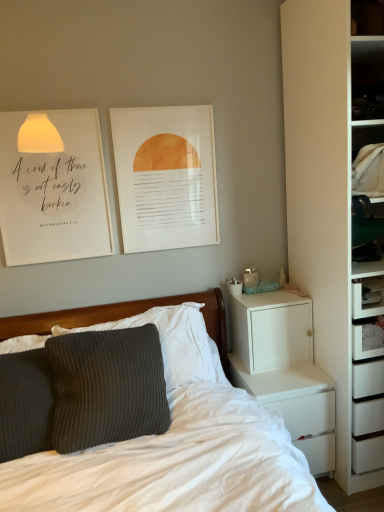
You are a GUI agent. You are given a task and a screenshot of the screen. Output one action in this format:
    pyautogui.click(x=<x>, y=<y>)
    Task: Click on the white matte chest of drawers at right
    The image size is (384, 512).
    Given the screenshot: What is the action you would take?
    pyautogui.click(x=284, y=369)

What is the approximate width of dark grey textured pillow at left?

dark grey textured pillow at left is 20.34 inches in width.

The width and height of the screenshot is (384, 512). Describe the element at coordinates (53, 187) in the screenshot. I see `white paper at upper left` at that location.

Identify the location of matte paper picture frame at upper center. This screenshot has width=384, height=512. (165, 176).

Which of these two, white matte chest of drawers at right or dark grey textured pillow at left, stands taller?

Standing taller between the two is white matte chest of drawers at right.

In the scene shown: From the image's perspective, which is below, white matte chest of drawers at right or dark grey textured pillow at left?

white matte chest of drawers at right.

Is white matte chest of drawers at right closer to camera compared to dark grey textured pillow at left?

No, white matte chest of drawers at right is behind dark grey textured pillow at left.

Between matte paper picture frame at upper center and dark grey textured pillow at left, which one appears on the right side from the viewer's perspective?

matte paper picture frame at upper center.

Considering the relative sizes of matte paper picture frame at upper center and dark grey textured pillow at left in the image provided, is matte paper picture frame at upper center thinner than dark grey textured pillow at left?

Yes, matte paper picture frame at upper center is thinner than dark grey textured pillow at left.

Is matte paper picture frame at upper center located outside dark grey textured pillow at left?

Absolutely, matte paper picture frame at upper center is external to dark grey textured pillow at left.

Considering the points (131, 179) and (47, 408), which point is in front, point (131, 179) or point (47, 408)?

The point (47, 408) is closer.

Is the depth of dark grey textured pillow at left greater than that of white matte chest of drawers at right?

No, dark grey textured pillow at left is in front of white matte chest of drawers at right.

How different are the orientations of dark grey textured pillow at left and white matte chest of drawers at right in degrees?

dark grey textured pillow at left and white matte chest of drawers at right are facing 1.19 degrees away from each other.

Looking at this image, from the image's perspective, which one is positioned higher, dark grey textured pillow at left or white matte chest of drawers at right?

From the image's view, dark grey textured pillow at left is above.

What's the angular difference between white matte cabinet at right and white paper at upper left's facing directions?

They differ by 0.133 degrees in their facing directions.

Is white matte cabinet at right located outside white paper at upper left?

Absolutely, white matte cabinet at right is external to white paper at upper left.

Which object is wider, white matte cabinet at right or white paper at upper left?

white matte cabinet at right is wider.

Is white paper at upper left with white matte chest of drawers at right?

No.

How far apart are white paper at upper left and white matte chest of drawers at right?

white paper at upper left is 3.59 feet from white matte chest of drawers at right.

Is white matte chest of drawers at right completely or partially inside white paper at upper left?

That's incorrect, white matte chest of drawers at right is not inside white paper at upper left.

How different are the orientations of white paper at upper left and white matte chest of drawers at right in degrees?

0.263 degrees.

From the picture: Between white matte cabinet at right and white matte chest of drawers at right, which one has less height?

white matte cabinet at right.

Can white matte chest of drawers at right be found inside white matte cabinet at right?

No.

Identify the location of the chest of drawers that is below the white matte cabinet at right (from the image's perspective). (284, 369).

Is white matte cabinet at right aimed at white matte chest of drawers at right?

No, white matte cabinet at right is not turned towards white matte chest of drawers at right.

Which object is further away from the camera, matte paper picture frame at upper center or white paper at upper left?

matte paper picture frame at upper center is further away from the camera.

This screenshot has height=512, width=384. In order to click on picture frame behind the white paper at upper left in this screenshot , I will do `click(165, 176)`.

From the image's perspective, which is above, matte paper picture frame at upper center or white paper at upper left?

From the image's view, matte paper picture frame at upper center is above.

From a real-world perspective, is matte paper picture frame at upper center on top of white paper at upper left?

Yes, from a real-world perspective, matte paper picture frame at upper center is on top of white paper at upper left.

Image resolution: width=384 pixels, height=512 pixels. I want to click on chest of drawers to the right of dark grey textured pillow at left, so click(284, 369).

In the image, there is a matte paper picture frame at upper center. At what (x,y) coordinates should I click in order to perform the action: click on pillow below it (from the image's perspective). Please return your answer as a coordinate pair (x, y). This screenshot has height=512, width=384. Looking at the image, I should click on (25, 404).

Based on their spatial positions, is dark grey textured pillow at left or white paper at upper left closer to matte paper picture frame at upper center?

white paper at upper left is closer to matte paper picture frame at upper center.

Looking at the image, which one is located further to white paper at upper left, white matte cabinet at right or white matte chest of drawers at right?

white matte chest of drawers at right lies further to white paper at upper left than the other object.

Considering their positions, is white matte cabinet at right positioned closer to matte paper picture frame at upper center than white paper at upper left?

white paper at upper left.

Looking at the image, which one is located closer to white paper at upper left, dark grey textured pillow at left or matte paper picture frame at upper center?

matte paper picture frame at upper center is closer to white paper at upper left.

Based on their spatial positions, is white paper at upper left or matte paper picture frame at upper center further from dark grey textured pillow at left?

The object further to dark grey textured pillow at left is matte paper picture frame at upper center.

From the image, which object appears to be nearer to white matte chest of drawers at right, matte paper picture frame at upper center or white paper at upper left?

Among the two, matte paper picture frame at upper center is located nearer to white matte chest of drawers at right.

Looking at the image, which one is located closer to dark grey textured pillow at left, matte paper picture frame at upper center or white matte cabinet at right?

The object closer to dark grey textured pillow at left is matte paper picture frame at upper center.

From the image, which object appears to be nearer to white matte chest of drawers at right, white matte cabinet at right or dark grey textured pillow at left?

Among the two, white matte cabinet at right is located nearer to white matte chest of drawers at right.

Locate an element on the screen. This screenshot has height=512, width=384. picture frame between dark grey textured pillow at left and white matte cabinet at right is located at coordinates (165, 176).

In order to click on nightstand between matte paper picture frame at upper center and white matte chest of drawers at right from top to bottom in this screenshot , I will do `click(271, 330)`.

At what (x,y) coordinates should I click in order to perform the action: click on bulletin board situated between dark grey textured pillow at left and white matte chest of drawers at right from left to right. Please return your answer as a coordinate pair (x, y). The height and width of the screenshot is (512, 384). Looking at the image, I should click on (53, 187).

You are a GUI agent. You are given a task and a screenshot of the screen. Output one action in this format:
    pyautogui.click(x=<x>, y=<y>)
    Task: Click on the picture frame located between white paper at upper left and white matte cabinet at right in the left-right direction
    
    Given the screenshot: What is the action you would take?
    pyautogui.click(x=165, y=176)